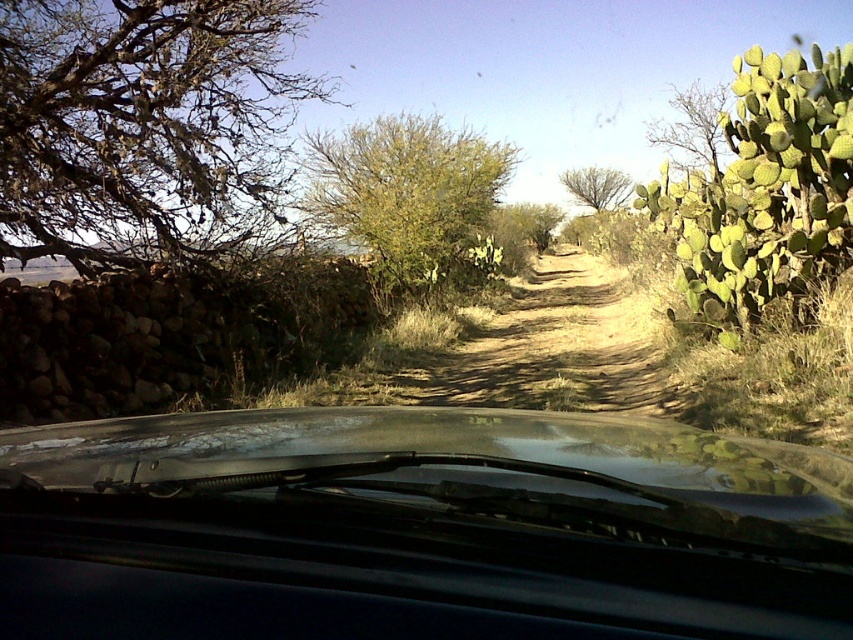
Based on the photo, you are driving on an unpaved road in a semi arid area and see a green leafy bush at center and a green leafy tree at center ahead. Which one is more to the left?

The green leafy bush at center is positioned on the left side of the green leafy tree at center, so the bush is more to the left.